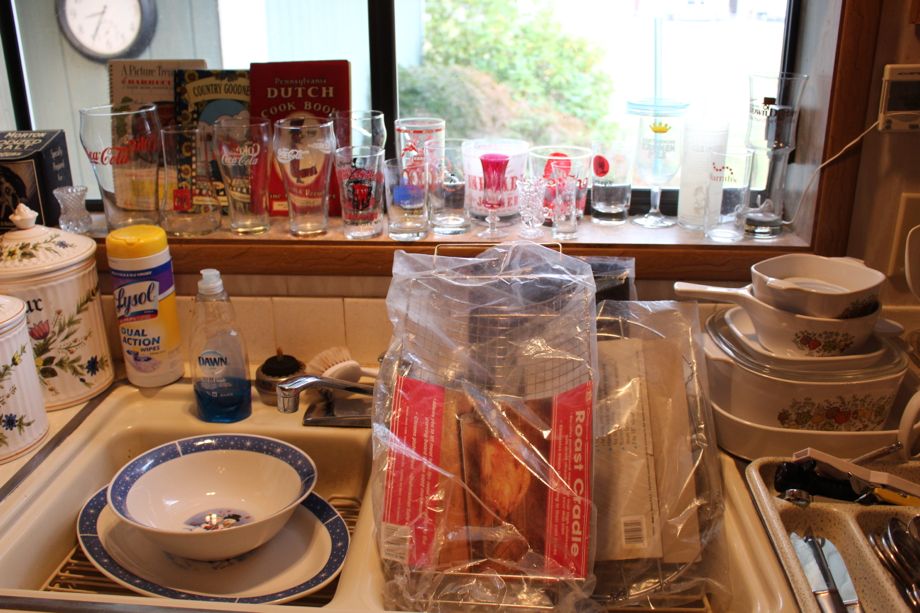
Where is `faucet`? The height and width of the screenshot is (613, 920). faucet is located at coordinates (291, 393).